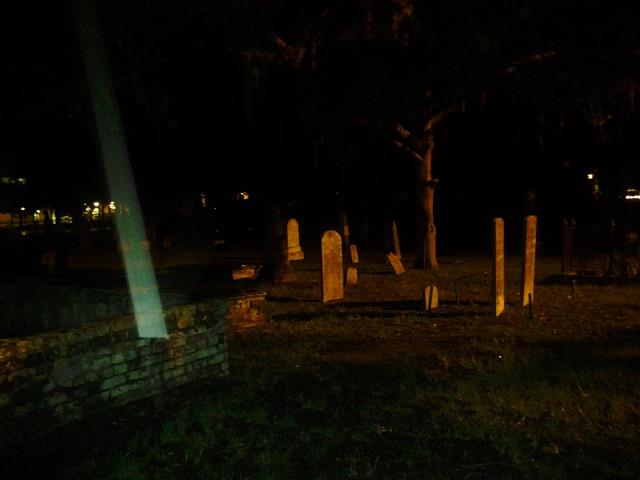
Please find where you'd put flowers in the image and show me where they are. Your answer should be formatted as a list of tuples, i.e. [(x1, y1), (x2, y2), ...], where each tuple contains the x and y coordinates of a point satisfying the conditions above.

[(500, 318), (527, 311), (440, 314), (340, 303), (354, 291), (410, 277), (253, 283), (304, 266), (361, 266)]